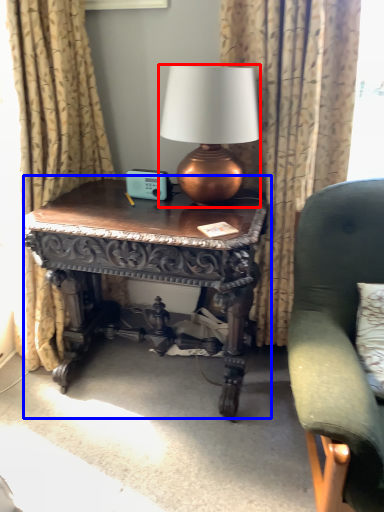
Question: Which point is further to the camera, lamp (highlighted by a red box) or table (highlighted by a blue box)?

Choices:
 (A) lamp
 (B) table

Answer: (B)